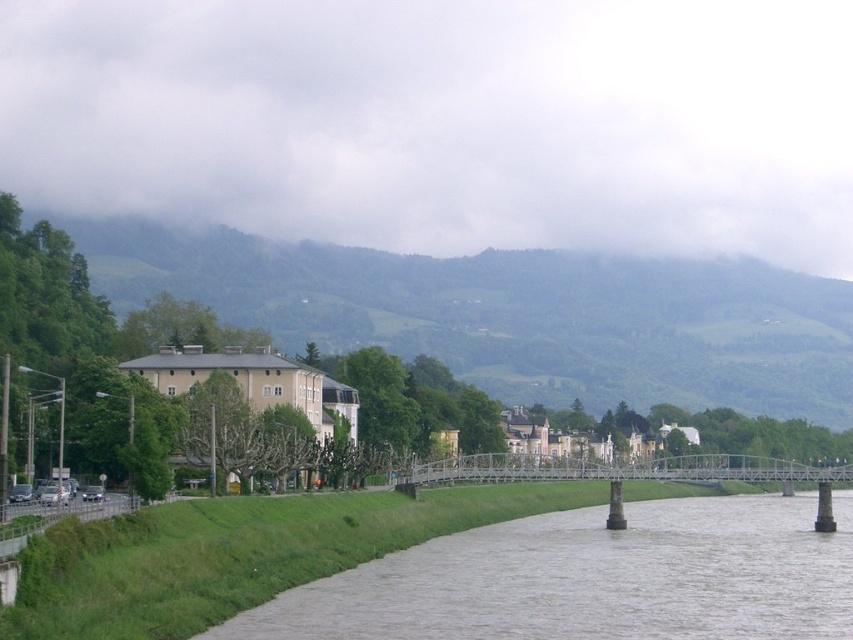
You are a pedestrian standing on the white metal bridge at center. You want to cross the river to the left bank. Can you see the gray concrete river at lower center from your position on the bridge?

The gray concrete river at lower center is shorter than the white metal bridge at center, so yes, you can see the gray concrete river at lower center from the bridge because the bridge is longer and spans over it.

You are standing on the paved pathway along the riverside and want to cross the river to the opposite bank. There is a bridge in the midground. However, you notice a point marked at coordinates point (590, 579). Based on the scene description, where exactly is this point located relative to the river?

The point (590, 579) is located on the gray concrete river at lower center, meaning it is situated on the river surface near the center of the image.

You are standing at the center of the bridge and want to cross to the other side. The gray concrete river at lower center is in your path. Based on its position, can you estimate whether the river is wider than the bridge? Please explain your reasoning.

The gray concrete river at lower center is positioned at point (590, 579). Without additional information about the bridge or river dimensions, it is impossible to determine if the river is wider than the bridge.